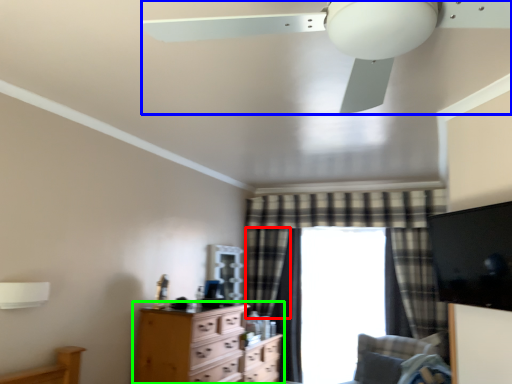
Question: Which is nearer to the curtain (highlighted by a red box)? ceiling fan (highlighted by a blue box) or chest of drawers (highlighted by a green box).

Choices:
 (A) ceiling fan
 (B) chest of drawers

Answer: (B)